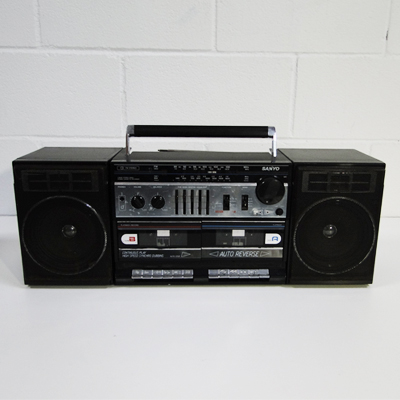
Image resolution: width=400 pixels, height=400 pixels. What are the coordinates of `speakers` in the screenshot? It's located at (72, 227), (330, 227).